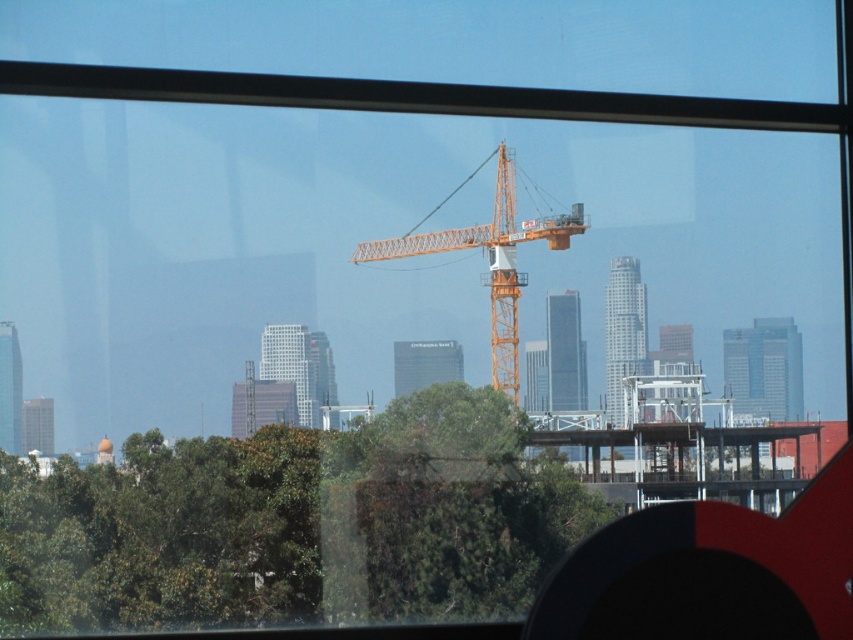
Question: Does green leafy tree at center have a lesser width compared to orange metallic crane at center?

Choices:
 (A) no
 (B) yes

Answer: (A)

Question: Is green leafy tree at center wider than orange metallic crane at center?

Choices:
 (A) no
 (B) yes

Answer: (B)

Question: Does green leafy tree at center come behind orange metallic crane at center?

Choices:
 (A) no
 (B) yes

Answer: (A)